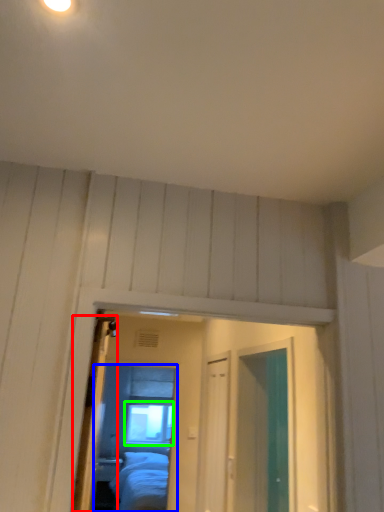
Question: Which object is positioned closest to door (highlighted by a red box)? Select from mirror (highlighted by a blue box) and window (highlighted by a green box).

Choices:
 (A) mirror
 (B) window

Answer: (A)